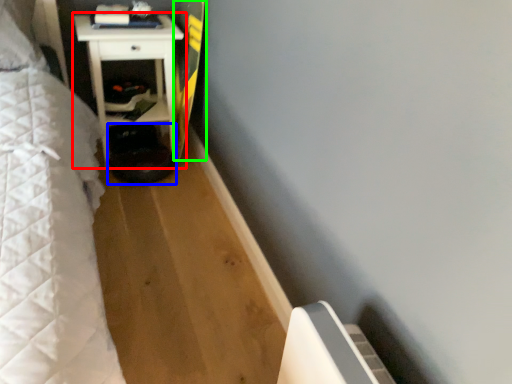
Question: Considering the real-world distances, which object is closest to furniture (highlighted by a red box)? step stool (highlighted by a blue box) or longboard (highlighted by a green box).

Choices:
 (A) step stool
 (B) longboard

Answer: (B)